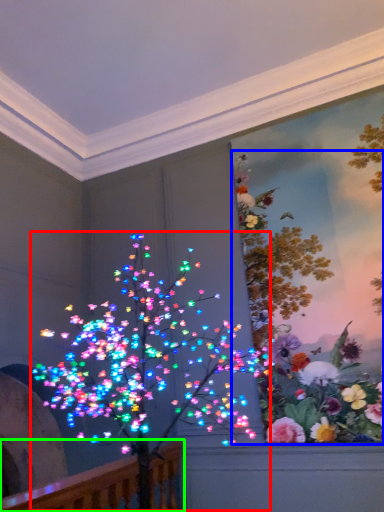
Question: Considering the real-world distances, which object is farthest from christmas decoration (highlighted by a red box)? floral arrangement (highlighted by a blue box) or rail (highlighted by a green box)?

Choices:
 (A) floral arrangement
 (B) rail

Answer: (B)